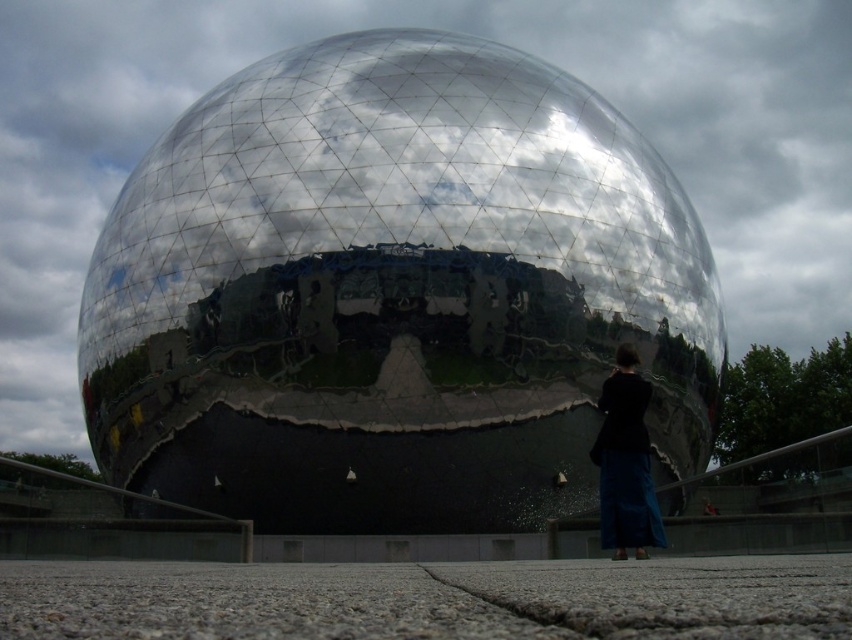
You are standing at the origin point of a coordinate system placed at the bottom left corner of the image. The metallic sphere at center is located at coordinates approximately where? Please provide the coordinates as a pair of numbers in parentheses.

The metallic sphere at center is located at coordinates approximately at point (393, 292).

You are standing in front of the metallic sphere and want to place a small decoration between the two points marked as point (637, 305) and point (635, 465). Which point should you place the decoration closer to if you want it to be closer to the viewer?

You should place the decoration closer to point (637, 305) because it is further to the viewer than point (635, 465).